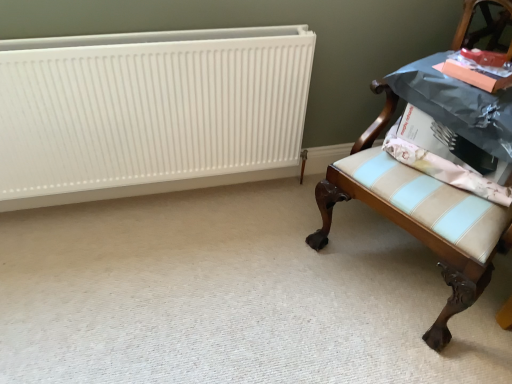
In order to click on vacant space that is to the left of wooden upholstered chair at right in this screenshot , I will do `click(267, 273)`.